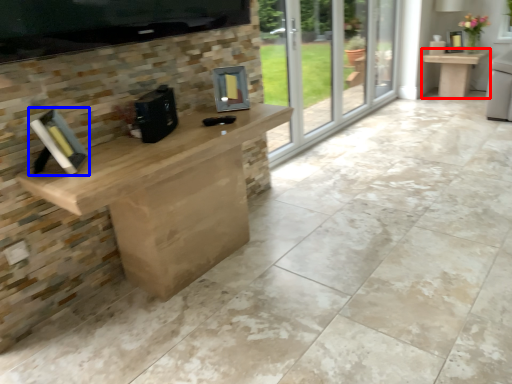
Question: Which object is further to the camera taking this photo, table (highlighted by a red box) or book (highlighted by a blue box)?

Choices:
 (A) table
 (B) book

Answer: (A)